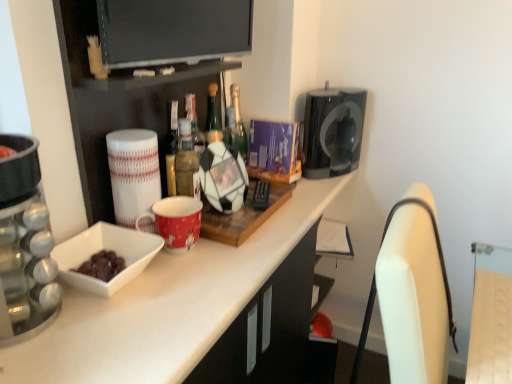
This screenshot has height=384, width=512. I want to click on white glossy mug at upper center, so click(140, 67).

The height and width of the screenshot is (384, 512). Identify the location of light brown wood swivel chair at right, marked as the 1th swivel chair in a top-to-bottom arrangement. (490, 316).

Describe the element at coordinates (239, 122) in the screenshot. I see `green glass bottle at center` at that location.

How much space does black glossy coffee machine at upper right, arranged as the 1th appliance when viewed from the right, occupy horizontally?

7.83 inches.

Identify the location of black glossy coffee machine at upper right, the 2th appliance viewed from the left. (332, 131).

This screenshot has width=512, height=384. What are the coordinates of `white glossy countertop at center` in the screenshot? It's located at (166, 307).

Is white glossy countertop at center touching flat screen tv at upper center?

white glossy countertop at center and flat screen tv at upper center are clearly separated.

In the scene shown: From a real-world perspective, between white glossy countertop at center and flat screen tv at upper center, who is vertically lower?

white glossy countertop at center, from a real-world perspective.

Who is taller, white glossy countertop at center or flat screen tv at upper center?

Standing taller between the two is white glossy countertop at center.

In terms of height, does white glossy countertop at center look taller or shorter compared to white glossy mug at upper center?

Clearly, white glossy countertop at center is taller compared to white glossy mug at upper center.

Between point (267, 236) and point (224, 69), which one is positioned behind?

Point (224, 69)

Looking at this image, would you say white glossy countertop at center is outside white glossy mug at upper center?

Yes, white glossy countertop at center is located beyond the bounds of white glossy mug at upper center.

From a real-world perspective, relative to white glossy mug at upper center, is white glossy countertop at center vertically above or below?

white glossy countertop at center is situated lower than white glossy mug at upper center in the real world.

From a real-world perspective, is red glossy mug at center beneath white glossy countertop at center?

No, from a real-world perspective, red glossy mug at center is not under white glossy countertop at center.

Is red glossy mug at center smaller than white glossy countertop at center?

Correct, red glossy mug at center occupies less space than white glossy countertop at center.

Is red glossy mug at center to the left of white glossy countertop at center from the viewer's perspective?

Yes.

Looking at their sizes, would you say red glossy mug at center is wider or thinner than white glossy countertop at center?

Considering their sizes, red glossy mug at center looks slimmer than white glossy countertop at center.

Image resolution: width=512 pixels, height=384 pixels. In order to click on mug to the right of white ceramic mug at left, which appears as the 1th appliance when viewed from the left in this screenshot , I will do `click(176, 222)`.

Between white ceramic mug at left, the 1th appliance in the front-to-back sequence, and red glossy mug at center, which one has smaller width?

white ceramic mug at left, the 1th appliance in the front-to-back sequence.

From the image's perspective, would you say white ceramic mug at left, which appears as the 1th appliance when viewed from the left, is shown under red glossy mug at center?

No.

Which is behind, point (122, 204) or point (173, 225)?

The point (122, 204) is more distant.

From the image's perspective, between white ceramic mug at left, marked as the 2th appliance in a back-to-front arrangement, and white leather swivel chair at right, acting as the 1th swivel chair starting from the bottom, who is located below?

white leather swivel chair at right, acting as the 1th swivel chair starting from the bottom, is shown below in the image.

Is white leather swivel chair at right, acting as the 1th swivel chair starting from the bottom, located within white ceramic mug at left, marked as the 2th appliance in a back-to-front arrangement?

No, white leather swivel chair at right, acting as the 1th swivel chair starting from the bottom, is not a part of white ceramic mug at left, marked as the 2th appliance in a back-to-front arrangement.

Is white ceramic mug at left, the second appliance when ordered from right to left, not close to white leather swivel chair at right, acting as the 1th swivel chair starting from the bottom?

No, white ceramic mug at left, the second appliance when ordered from right to left, is not far from white leather swivel chair at right, acting as the 1th swivel chair starting from the bottom.

From the picture: Is the position of white ceramic mug at left, which appears as the 1th appliance when viewed from the left, more distant than that of white leather swivel chair at right, acting as the 1th swivel chair starting from the bottom?

Yes, white ceramic mug at left, which appears as the 1th appliance when viewed from the left, is behind white leather swivel chair at right, acting as the 1th swivel chair starting from the bottom.

Which of these two, light brown wood swivel chair at right, marked as the 1th swivel chair in a top-to-bottom arrangement, or flat screen tv at upper center, stands taller?

flat screen tv at upper center.

Would you say light brown wood swivel chair at right, arranged as the second swivel chair when ordered from the bottom, is outside flat screen tv at upper center?

That's correct, light brown wood swivel chair at right, arranged as the second swivel chair when ordered from the bottom, is outside of flat screen tv at upper center.

Is light brown wood swivel chair at right, marked as the 1th swivel chair in a top-to-bottom arrangement, placed right next to flat screen tv at upper center?

No, light brown wood swivel chair at right, marked as the 1th swivel chair in a top-to-bottom arrangement, is not next to flat screen tv at upper center.

From a real-world perspective, which swivel chair is the 1st one underneath the flat screen tv at upper center? Please provide its 2D coordinates.

[(490, 316)]

From a real-world perspective, between white glossy mug at upper center and flat screen tv at upper center, who is vertically higher?

flat screen tv at upper center, from a real-world perspective.

Which object is thinner, white glossy mug at upper center or flat screen tv at upper center?

flat screen tv at upper center is thinner.

Could you tell me if white glossy mug at upper center is turned towards flat screen tv at upper center?

Yes, white glossy mug at upper center is oriented towards flat screen tv at upper center.

From the image's perspective, between white glossy mug at upper center and flat screen tv at upper center, who is located below?

white glossy mug at upper center appears lower in the image.

Identify the location of television behind the white glossy countertop at center. (172, 31).

I want to click on countertop below the white glossy mug at upper center (from the image's perspective), so click(x=166, y=307).

Looking at the image, which one is located further to green glass bottle at center, white leather swivel chair at right, the second swivel chair from the top, or white glossy mug at upper center?

The object further to green glass bottle at center is white leather swivel chair at right, the second swivel chair from the top.

Looking at the image, which one is located further to white glossy bowl at left, red glossy mug at center or white glossy mug at upper center?

white glossy mug at upper center lies further to white glossy bowl at left than the other object.

When comparing their distances from white ceramic mug at left, marked as the 2th appliance in a back-to-front arrangement, does white glossy bowl at center left or light brown wood swivel chair at right, marked as the 1th swivel chair in a top-to-bottom arrangement, seem further?

light brown wood swivel chair at right, marked as the 1th swivel chair in a top-to-bottom arrangement, lies further to white ceramic mug at left, marked as the 2th appliance in a back-to-front arrangement, than the other object.

Which object lies nearer to the anchor point white glossy bowl at left, white ceramic mug at left, the 1th appliance in the front-to-back sequence, or red glossy mug at center?

white ceramic mug at left, the 1th appliance in the front-to-back sequence, is closer to white glossy bowl at left.

Estimate the real-world distances between objects in this image. Which object is further from white glossy countertop at center, green glass bottle at center or white glossy mug at upper center?

Among the two, green glass bottle at center is located further to white glossy countertop at center.

From the image, which object appears to be farther from white glossy bowl at center left, white glossy countertop at center or green glass bottle at center?

green glass bottle at center.

Estimate the real-world distances between objects in this image. Which object is further from black glossy coffee machine at upper right, positioned as the 1th appliance in back-to-front order, light brown wood swivel chair at right, arranged as the second swivel chair when ordered from the bottom, or white glossy countertop at center?

light brown wood swivel chair at right, arranged as the second swivel chair when ordered from the bottom, lies further to black glossy coffee machine at upper right, positioned as the 1th appliance in back-to-front order, than the other object.

Based on their spatial positions, is light brown wood swivel chair at right, marked as the 1th swivel chair in a top-to-bottom arrangement, or white glossy bowl at center left closer to white leather swivel chair at right, acting as the 1th swivel chair starting from the bottom?

light brown wood swivel chair at right, marked as the 1th swivel chair in a top-to-bottom arrangement, is positioned closer to the anchor white leather swivel chair at right, acting as the 1th swivel chair starting from the bottom.

You are a GUI agent. You are given a task and a screenshot of the screen. Output one action in this format:
    pyautogui.click(x=<x>, y=<y>)
    Task: Click on the bowl between white glossy bowl at left and light brown wood swivel chair at right, marked as the 1th swivel chair in a top-to-bottom arrangement, from left to right
    The height and width of the screenshot is (384, 512).
    Given the screenshot: What is the action you would take?
    (106, 249)

Where is `shelf between flat screen tv at upper center and white leather swivel chair at right, acting as the 1th swivel chair starting from the bottom, vertically`? This screenshot has height=384, width=512. shelf between flat screen tv at upper center and white leather swivel chair at right, acting as the 1th swivel chair starting from the bottom, vertically is located at coordinates (140, 67).

The image size is (512, 384). I want to click on television between white glossy bowl at center left and light brown wood swivel chair at right, arranged as the second swivel chair when ordered from the bottom, in the horizontal direction, so tap(172, 31).

Locate an element on the screen. This screenshot has width=512, height=384. mug between flat screen tv at upper center and white glossy bowl at left vertically is located at coordinates (x=176, y=222).